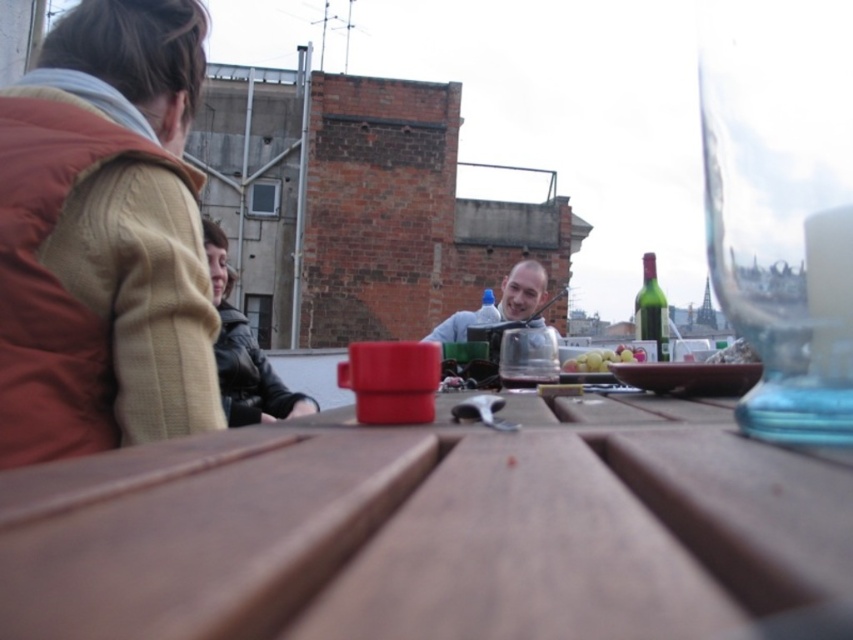
In the scene shown: Between green glass bottle at upper right and translucent plastic bottle at center, which one has more height?

With more height is translucent plastic bottle at center.

Can you confirm if green glass bottle at upper right is positioned to the right of translucent plastic bottle at center?

Yes, green glass bottle at upper right is to the right of translucent plastic bottle at center.

Find the location of a particular element. The image size is (853, 640). green glass bottle at upper right is located at coordinates (651, 308).

This screenshot has height=640, width=853. Identify the location of green glass bottle at upper right. (651, 308).

Does wooden picnic table at center have a lesser height compared to green glass bottle at upper right?

Correct, wooden picnic table at center is not as tall as green glass bottle at upper right.

You are a GUI agent. You are given a task and a screenshot of the screen. Output one action in this format:
    pyautogui.click(x=<x>, y=<y>)
    Task: Click on the wooden picnic table at center
    The width and height of the screenshot is (853, 640).
    Given the screenshot: What is the action you would take?
    pyautogui.click(x=428, y=536)

At what (x,y) coordinates should I click in order to perform the action: click on wooden picnic table at center. Please return your answer as a coordinate pair (x, y). The width and height of the screenshot is (853, 640). Looking at the image, I should click on (428, 536).

In the scene shown: Does brown quilted vest at left have a lesser width compared to green glass bottle at upper right?

In fact, brown quilted vest at left might be wider than green glass bottle at upper right.

Which is behind, point (83, 417) or point (643, 336)?

The point (643, 336) is more distant.

Is point (113, 236) closer to camera compared to point (637, 324)?

Yes, point (113, 236) is closer to viewer.

Locate an element on the screen. This screenshot has width=853, height=640. brown quilted vest at left is located at coordinates (103, 241).